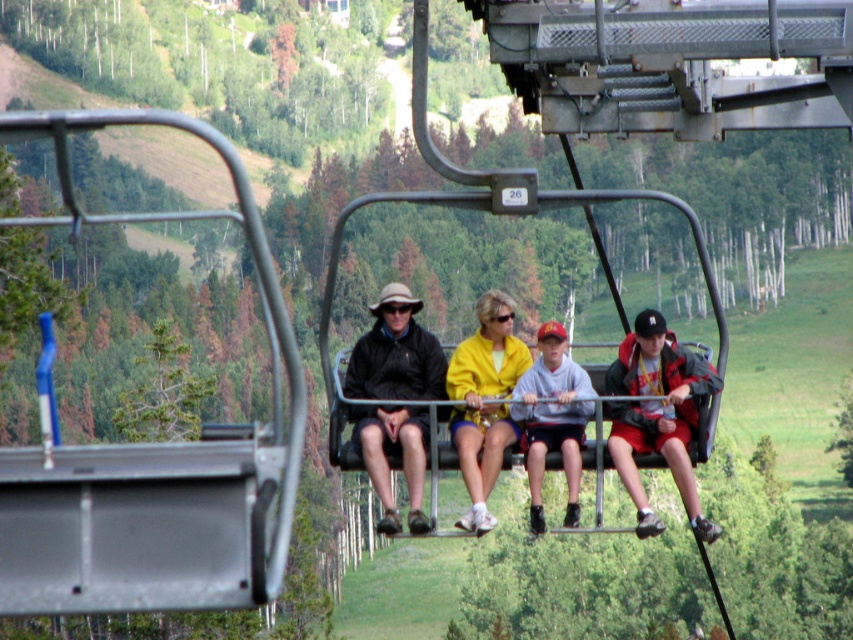
Can you confirm if red jacket at right is smaller than clear plastic goggles at center?

No.

You are a GUI agent. You are given a task and a screenshot of the screen. Output one action in this format:
    pyautogui.click(x=<x>, y=<y>)
    Task: Click on the red jacket at right
    The height and width of the screenshot is (640, 853).
    Given the screenshot: What is the action you would take?
    pyautogui.click(x=657, y=416)

Where is `red jacket at right`? red jacket at right is located at coordinates (657, 416).

Which of these two, red jacket at right or gray fleece sweatshirt at center, stands taller?

red jacket at right

Looking at this image, does red jacket at right appear on the left side of gray fleece sweatshirt at center?

In fact, red jacket at right is to the right of gray fleece sweatshirt at center.

Is point (705, 381) closer to viewer compared to point (561, 436)?

Yes.

The image size is (853, 640). Find the location of `red jacket at right`. red jacket at right is located at coordinates pyautogui.click(x=657, y=416).

Who is positioned more to the right, matte black jacket at center or clear plastic goggles at center?

From the viewer's perspective, clear plastic goggles at center appears more on the right side.

Can you confirm if matte black jacket at center is smaller than clear plastic goggles at center?

Actually, matte black jacket at center might be larger than clear plastic goggles at center.

The image size is (853, 640). What do you see at coordinates (396, 353) in the screenshot? I see `matte black jacket at center` at bounding box center [396, 353].

Where is `matte black jacket at center`? This screenshot has height=640, width=853. matte black jacket at center is located at coordinates (396, 353).